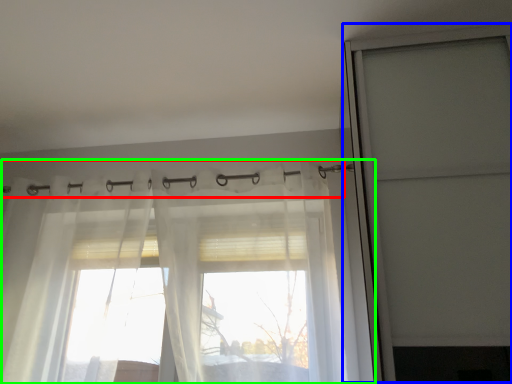
Question: Estimate the real-world distances between objects in this image. Which object is farther from clothesline (highlighted by a red box), screen door (highlighted by a blue box) or curtain (highlighted by a green box)?

Choices:
 (A) screen door
 (B) curtain

Answer: (B)